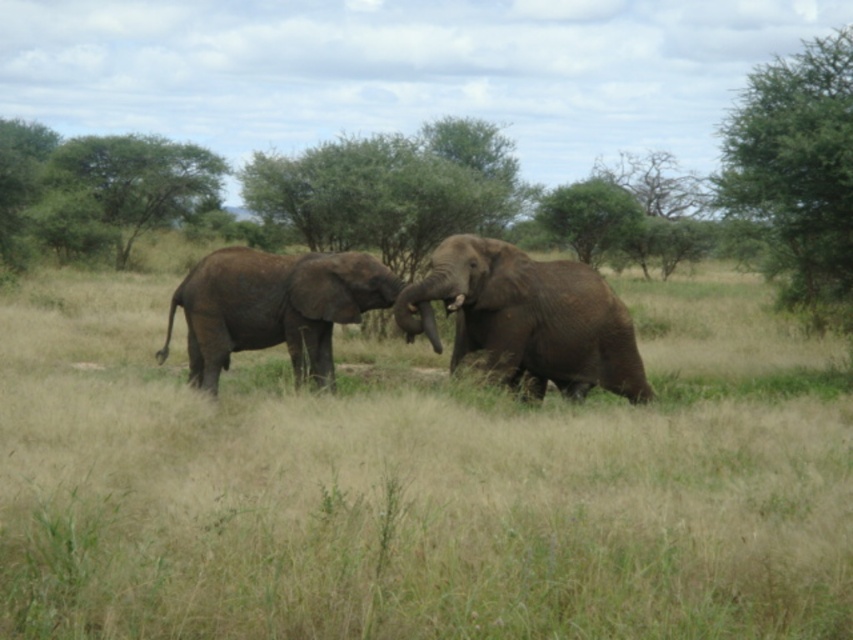
Question: Which point is farther from the camera taking this photo?

Choices:
 (A) (506, 349)
 (B) (566, 186)

Answer: (B)

Question: Is green leafy tree at upper right positioned behind green leafy tree at center?

Choices:
 (A) yes
 (B) no

Answer: (B)

Question: Can you confirm if green leafy tree at upper right is positioned above green leafy tree at upper left?

Choices:
 (A) yes
 (B) no

Answer: (A)

Question: Is brown textured elephant at left positioned at the back of green leafy tree at center?

Choices:
 (A) yes
 (B) no

Answer: (B)

Question: Which of the following is the farthest from the observer?

Choices:
 (A) (508, 308)
 (B) (292, 358)
 (C) (850, 138)

Answer: (C)

Question: Which of the following is the farthest from the observer?

Choices:
 (A) (598, 253)
 (B) (97, 157)
 (C) (471, 273)

Answer: (B)